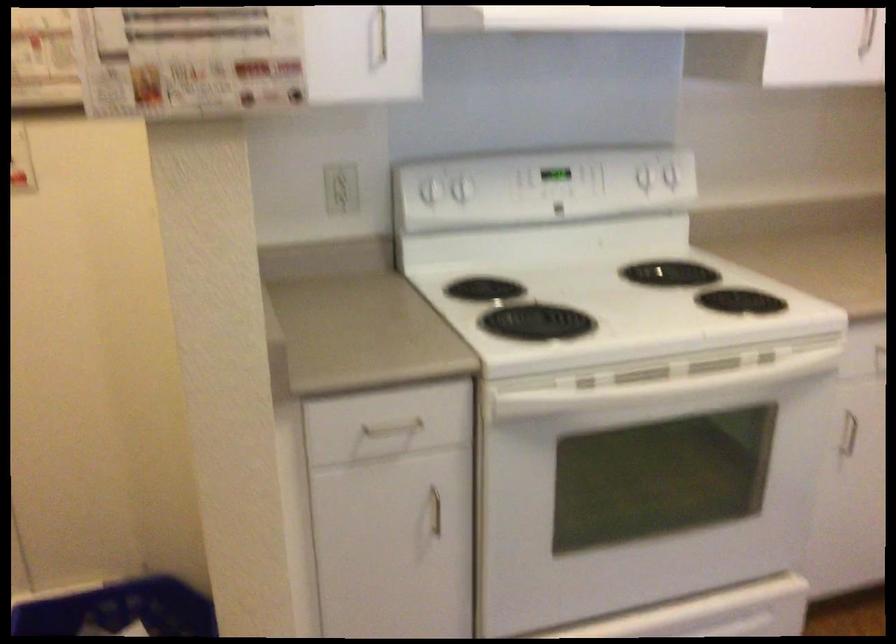
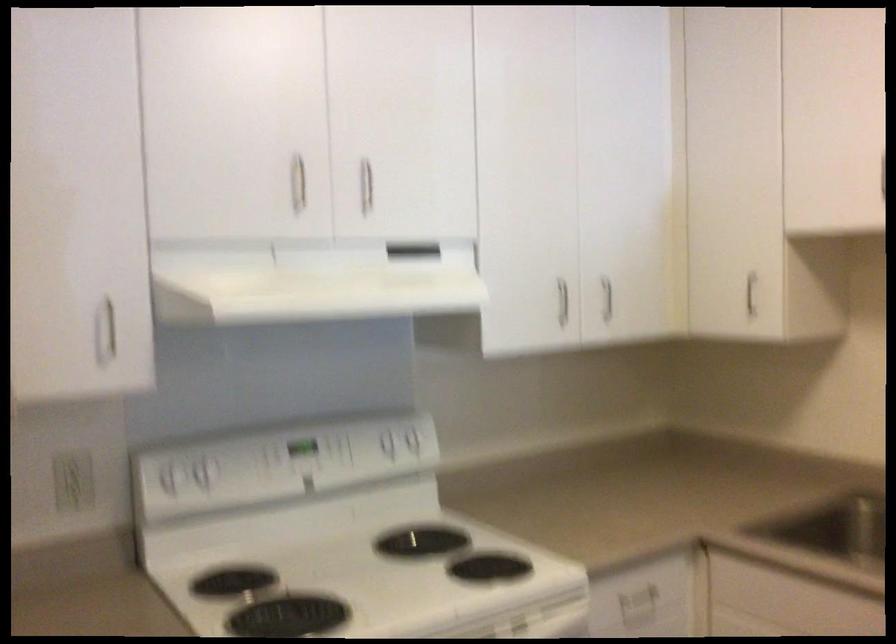
In the second image, find the point that corresponds to (432,185) in the first image.

(169, 476)